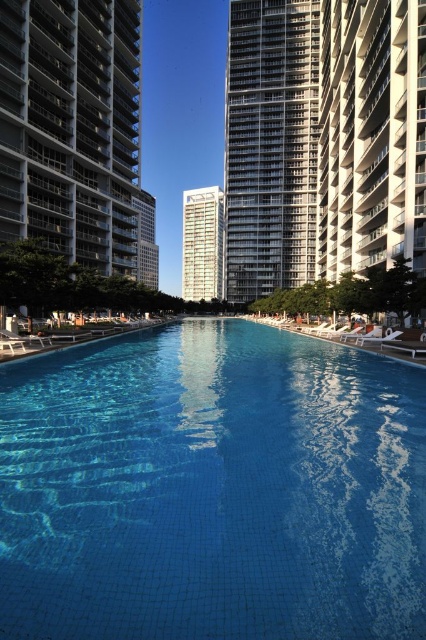
Question: Which point is closer to the camera taking this photo?

Choices:
 (A) (175, 525)
 (B) (216, 225)
 (C) (282, 93)

Answer: (A)

Question: Which object is positioned farthest from the silver metallic building at center?

Choices:
 (A) white glass tower at center
 (B) white glass condominium at left

Answer: (A)

Question: Is white glass condominium at left further to the viewer compared to white glass tower at center?

Choices:
 (A) no
 (B) yes

Answer: (A)

Question: Does silver metallic building at center appear on the right side of white glass tower at center?

Choices:
 (A) no
 (B) yes

Answer: (B)

Question: Which object is the farthest from the white glass tower at center?

Choices:
 (A) white textured building at center
 (B) blue tile swimming pool at center
 (C) silver metallic building at center

Answer: (B)

Question: Does blue tile swimming pool at center lie in front of white textured building at center?

Choices:
 (A) yes
 (B) no

Answer: (A)